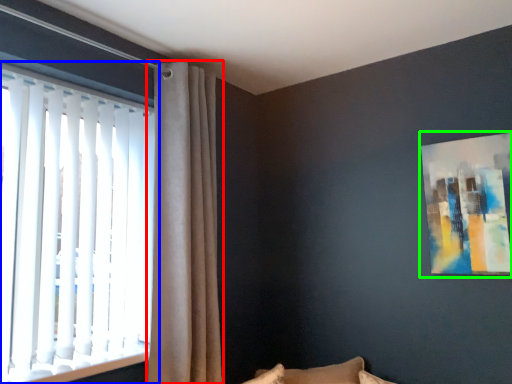
Question: Estimate the real-world distances between objects in this image. Which object is farther from curtain (highlighted by a red box), window (highlighted by a blue box) or picture frame (highlighted by a green box)?

Choices:
 (A) window
 (B) picture frame

Answer: (B)